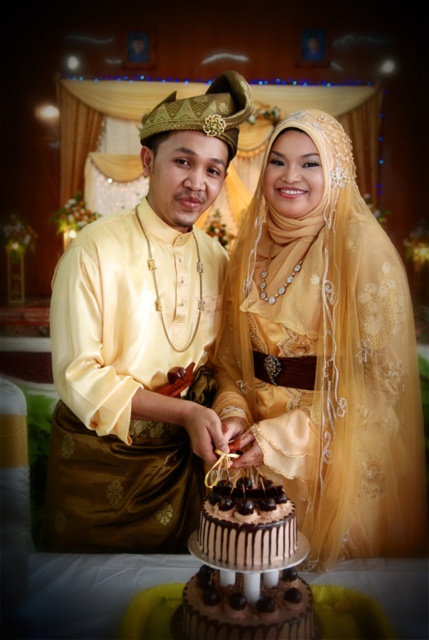
You are a photographer at a wedding. You need to capture a photo of the couple cutting the cake. The cake has two tiers. The top tier is the chocolate glazed cake at center, and the bottom tier is the chocolatesmoothcake at center. Which tier is higher?

The chocolate glazed cake at center is located above the chocolatesmoothcake at center, so the top tier is higher.

You are a photographer at the wedding. You need to capture a photo where the chocolate glazed cake at center is fully visible. The matte gold dress at center is currently blocking the cake. How can you adjust the couple to ensure the cake is visible?

The matte gold dress at center is positioned over chocolate glazed cake at center, so moving the couple slightly to the side would allow the cake to be fully visible in the photo.